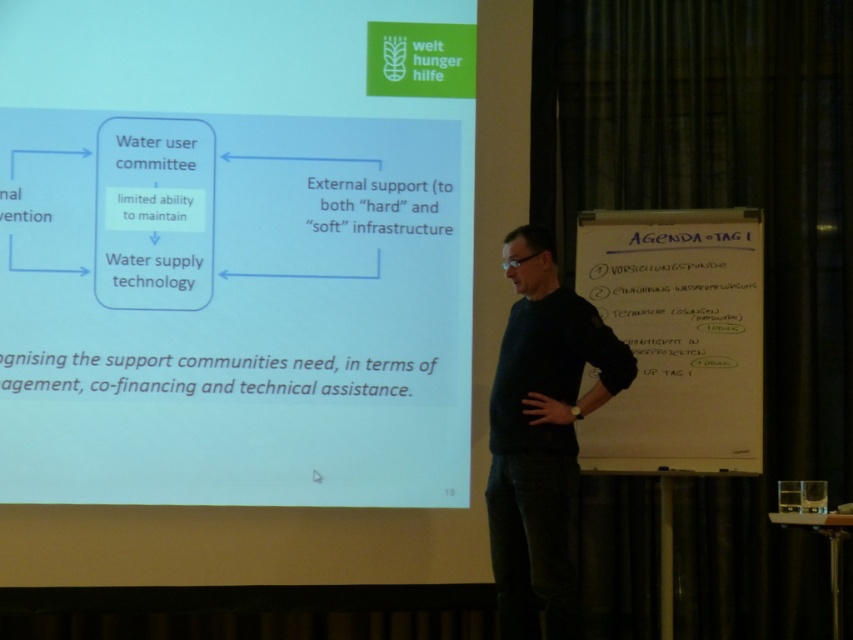
Question: Is blue paper at upper center to the right of whiteboard at right from the viewer's perspective?

Choices:
 (A) no
 (B) yes

Answer: (A)

Question: Which object appears farthest from the camera in this image?

Choices:
 (A) whiteboard at right
 (B) blue paper at upper center

Answer: (B)

Question: Can you confirm if blue paper at upper center is smaller than dark blue sweater at center?

Choices:
 (A) no
 (B) yes

Answer: (A)

Question: Which object is closer to the camera taking this photo?

Choices:
 (A) whiteboard at right
 (B) dark blue sweater at center
 (C) blue paper at upper center

Answer: (B)

Question: Does whiteboard at right appear under dark blue sweater at center?

Choices:
 (A) yes
 (B) no

Answer: (B)

Question: Among these objects, which one is nearest to the camera?

Choices:
 (A) dark blue sweater at center
 (B) blue paper at upper center
 (C) whiteboard at right

Answer: (A)